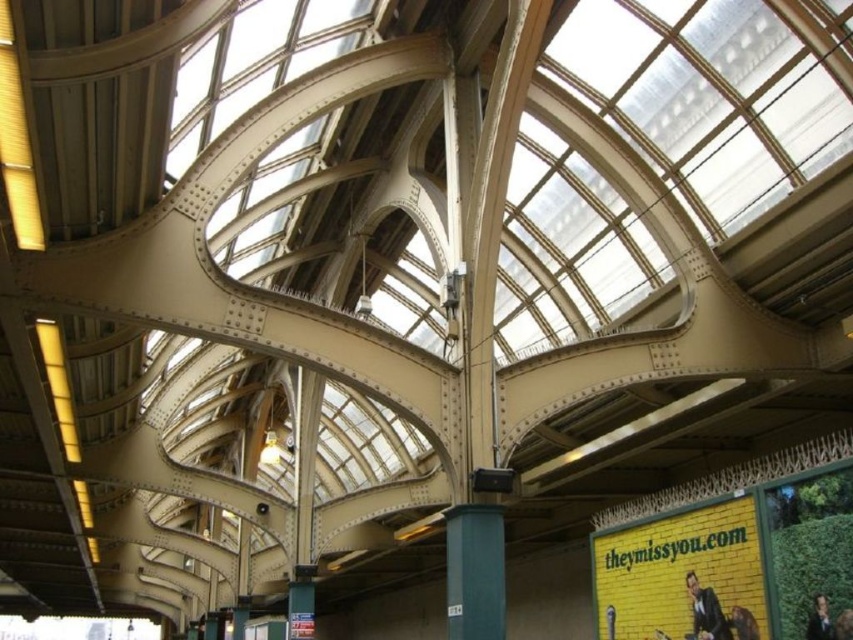
Can you confirm if dark suit at lower right is positioned to the left of dark brown hair at lower right?

Correct, you'll find dark suit at lower right to the left of dark brown hair at lower right.

Can you confirm if dark suit at lower right is shorter than dark brown hair at lower right?

Incorrect, dark suit at lower right's height does not fall short of dark brown hair at lower right's.

Is point (695, 588) behind point (809, 624)?

That is True.

The image size is (853, 640). What are the coordinates of `dark suit at lower right` in the screenshot? It's located at (705, 611).